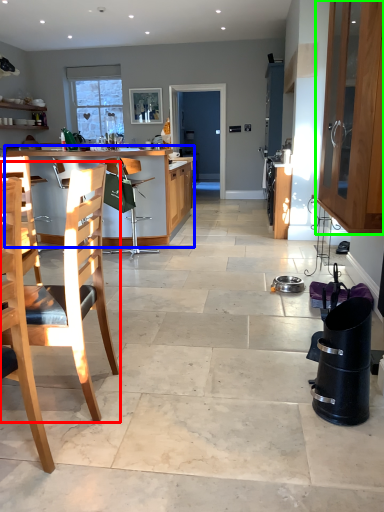
Question: Which is nearer to the chair (highlighted by a red box)? kitchen & dining room table (highlighted by a blue box) or cabinetry (highlighted by a green box).

Choices:
 (A) kitchen & dining room table
 (B) cabinetry

Answer: (B)